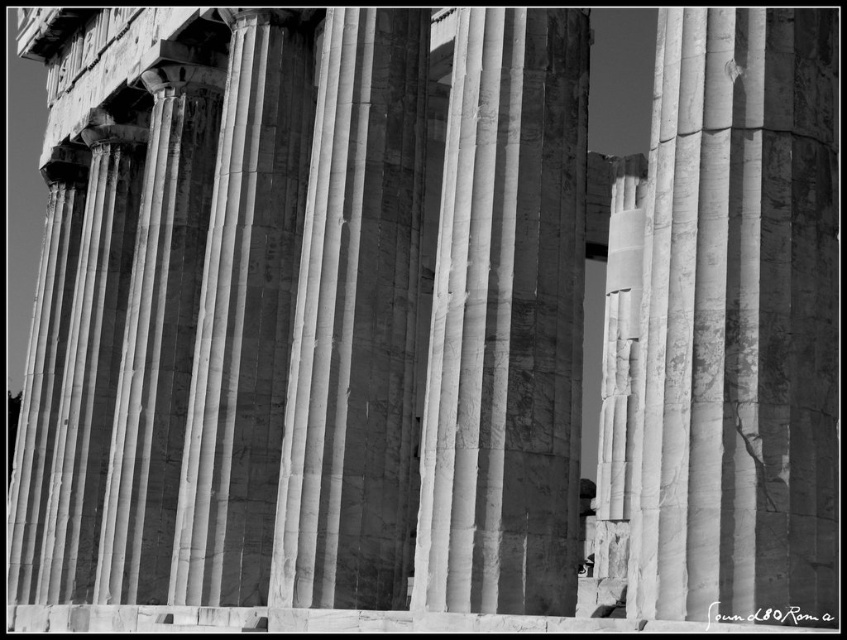
Question: Is marble column at center to the left of smooth marble column at center from the viewer's perspective?

Choices:
 (A) no
 (B) yes

Answer: (A)

Question: Among these points, which one is nearest to the camera?

Choices:
 (A) (336, 545)
 (B) (551, 333)

Answer: (B)

Question: Does marble column at center have a greater width compared to white marble column at center?

Choices:
 (A) no
 (B) yes

Answer: (B)

Question: Does marble column at center have a greater width compared to smooth marble column at center?

Choices:
 (A) no
 (B) yes

Answer: (B)

Question: Which point is closer to the camera?

Choices:
 (A) marble column at center
 (B) white marble column at center
 (C) smooth marble column at center

Answer: (A)

Question: Which of the following is the farthest from the observer?

Choices:
 (A) (234, 522)
 (B) (486, 449)
 (C) (386, 440)

Answer: (A)